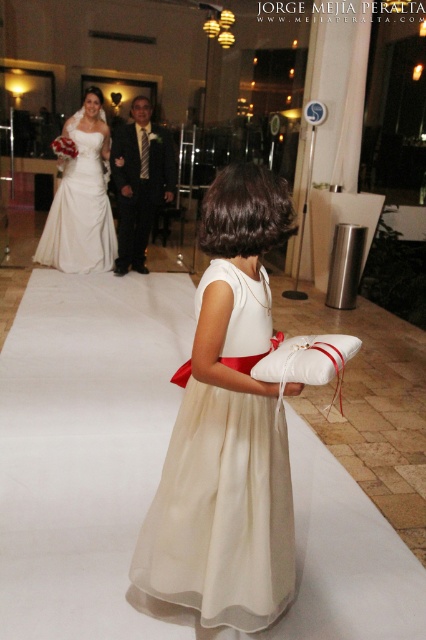
Between ivory satin dress at center and matte white dress at center, which one appears on the right side from the viewer's perspective?

From the viewer's perspective, ivory satin dress at center appears more on the right side.

Which is in front, point (158, 566) or point (94, 141)?

Point (158, 566) is more forward.

Locate an element on the screen. ivory satin dress at center is located at coordinates (221, 513).

Is the position of matte white dress at center more distant than that of shiny black suit at center?

That is False.

Can you confirm if matte white dress at center is positioned to the right of shiny black suit at center?

Incorrect, matte white dress at center is not on the right side of shiny black suit at center.

The width and height of the screenshot is (426, 640). Find the location of `matte white dress at center`. matte white dress at center is located at coordinates (81, 198).

Measure the distance between ivory satin dress at center and shiny black suit at center.

The distance of ivory satin dress at center from shiny black suit at center is 4.26 meters.

Identify the location of ivory satin dress at center. This screenshot has width=426, height=640. (221, 513).

Which is behind, point (190, 433) or point (167, 170)?

The point (167, 170) is behind.

Where is `ivory satin dress at center`? ivory satin dress at center is located at coordinates (221, 513).